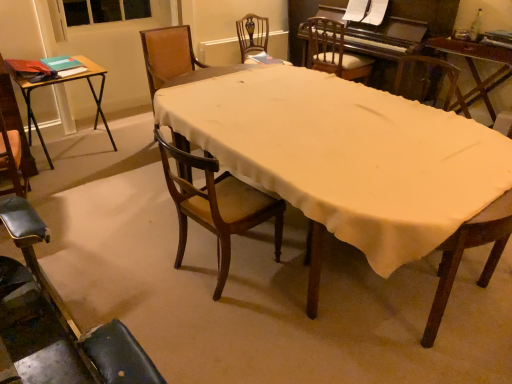
Question: From the image's perspective, is green glass bottle at upper right above or below wooden chair at upper center, which is counted as the fourth chair, starting from the front?

Choices:
 (A) below
 (B) above

Answer: (B)

Question: From a real-world perspective, is green glass bottle at upper right positioned above or below wooden chair at upper center, positioned as the 2th chair in back-to-front order?

Choices:
 (A) above
 (B) below

Answer: (A)

Question: Which object is the closest to the leather seat at lower left, which is counted as the first chair, starting from the front?

Choices:
 (A) wooden chair with ornate backrest at center, the fifth chair in the front-to-back sequence
 (B) polished dark wood piano at upper right
 (C) wooden table at center, which appears as the 2th table when viewed from the left
 (D) wooden table at center
 (E) green glass bottle at upper right

Answer: (D)

Question: Which of these objects is positioned closest to the wooden chair at upper center, positioned as the 2th chair in back-to-front order?

Choices:
 (A) wooden chair with ornate backrest at center, the fifth chair in the front-to-back sequence
 (B) brown wood chair at center, which is counted as the 4th chair, starting from the back
 (C) leather seat at lower left, the fifth chair positioned from the back
 (D) wooden chair at center, which is the third chair from front to back
 (E) wooden table at center

Answer: (A)